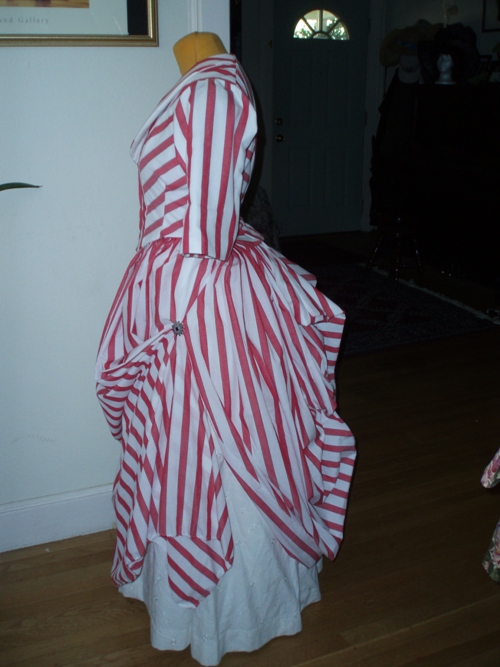
Where is `wall`? wall is located at coordinates (20, 389).